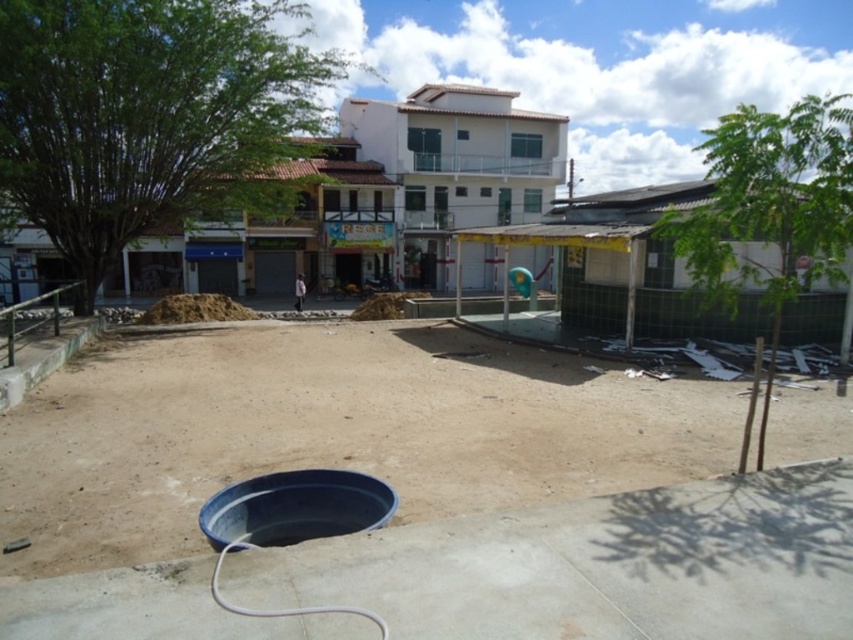
Question: Which point is closer to the camera?

Choices:
 (A) green leafy tree at right
 (B) green leafy tree at upper left
 (C) brown sandy dirt field at center

Answer: (C)

Question: Does brown sandy dirt field at center have a smaller size compared to green leafy tree at right?

Choices:
 (A) yes
 (B) no

Answer: (A)

Question: Among these objects, which one is farthest from the camera?

Choices:
 (A) brown sandy dirt field at center
 (B) green leafy tree at upper left
 (C) green leafy tree at right

Answer: (B)

Question: Is green leafy tree at upper left behind green leafy tree at right?

Choices:
 (A) no
 (B) yes

Answer: (B)

Question: Can you confirm if green leafy tree at upper left is thinner than green leafy tree at right?

Choices:
 (A) no
 (B) yes

Answer: (B)

Question: Which of the following is the closest to the observer?

Choices:
 (A) green leafy tree at right
 (B) green leafy tree at upper left
 (C) brown sandy dirt field at center

Answer: (C)